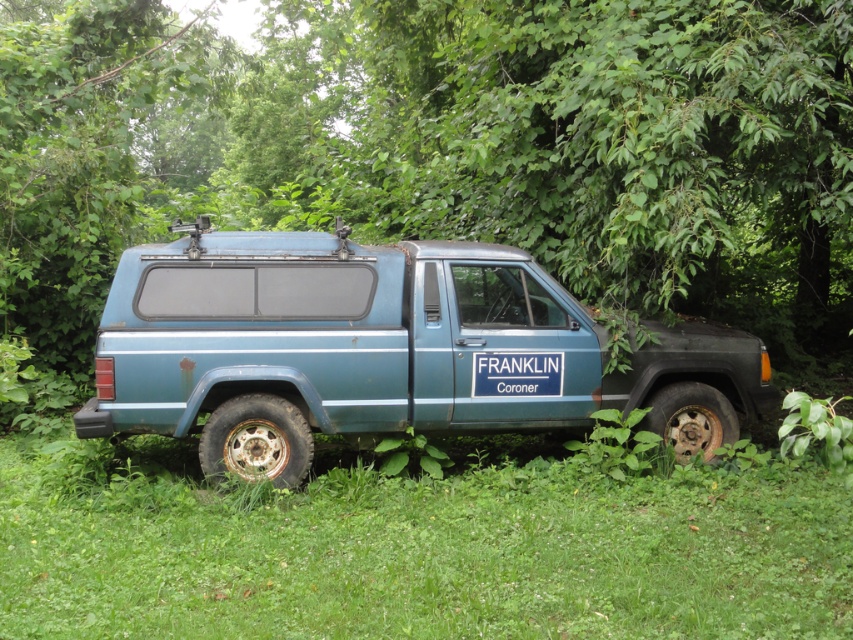
Question: Can you confirm if green grassy at lower center is positioned above rusty metal tire at lower right?

Choices:
 (A) no
 (B) yes

Answer: (A)

Question: Is the position of rusty teal van at center less distant than that of rusty metal tire at lower right?

Choices:
 (A) no
 (B) yes

Answer: (B)

Question: In this image, where is green grassy at lower center located relative to rusty metal tire at lower left?

Choices:
 (A) right
 (B) left

Answer: (A)

Question: Which point is closer to the camera taking this photo?

Choices:
 (A) (245, 257)
 (B) (834, 480)

Answer: (B)

Question: Which point is closer to the camera taking this photo?

Choices:
 (A) (715, 394)
 (B) (223, 428)

Answer: (B)

Question: Which object is positioned closest to the rusty metal tire at lower right?

Choices:
 (A) rusty metal tire at lower left
 (B) green grassy at lower center
 (C) rusty teal van at center

Answer: (C)